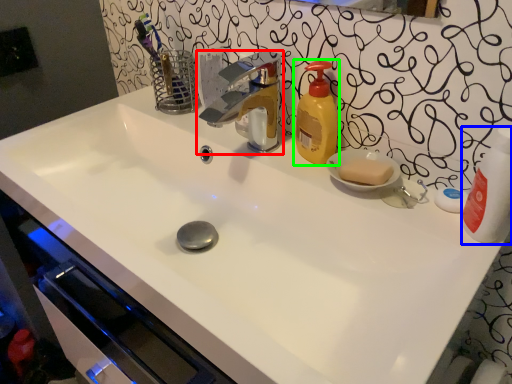
Question: Which object is the closest to the tap (highlighted by a red box)? Choose among these: cleaning product (highlighted by a blue box) or soap dispenser (highlighted by a green box).

Choices:
 (A) cleaning product
 (B) soap dispenser

Answer: (B)